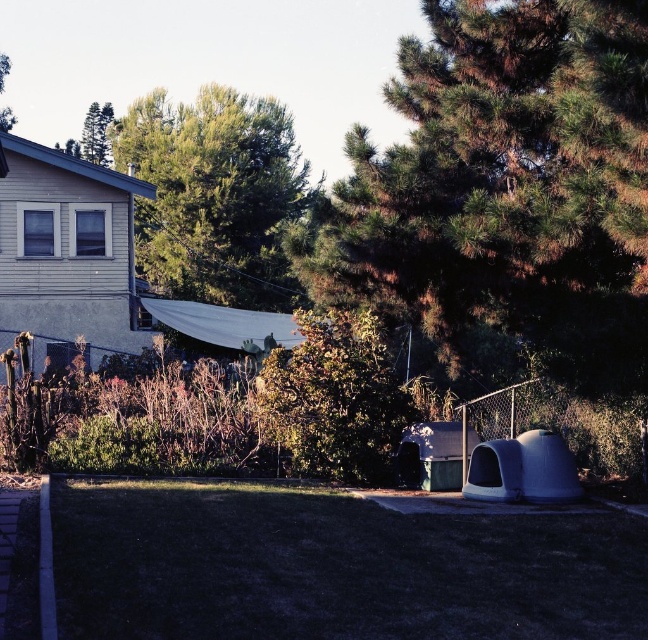
How much distance is there between green textured tree at upper left and green leafy tree at upper left?

5.88 meters

Who is positioned more to the right, green textured tree at upper left or green leafy tree at upper left?

green textured tree at upper left

I want to click on green textured tree at upper left, so click(97, 132).

Find the location of `green textured tree at upper left`. green textured tree at upper left is located at coordinates (97, 132).

From the picture: Is green textured tree at center positioned before green leafy tree at upper left?

Yes, it is in front of green leafy tree at upper left.

Is point (643, 166) positioned in front of point (0, 115)?

Yes, point (643, 166) is closer to viewer.

This screenshot has width=648, height=640. In order to click on green textured tree at center in this screenshot , I will do (503, 189).

Between green textured tree at center and green leafy tree at upper center, which one appears on the right side from the viewer's perspective?

From the viewer's perspective, green textured tree at center appears more on the right side.

Measure the distance between green textured tree at center and camera.

They are 7.47 meters apart.

The width and height of the screenshot is (648, 640). I want to click on green textured tree at center, so click(503, 189).